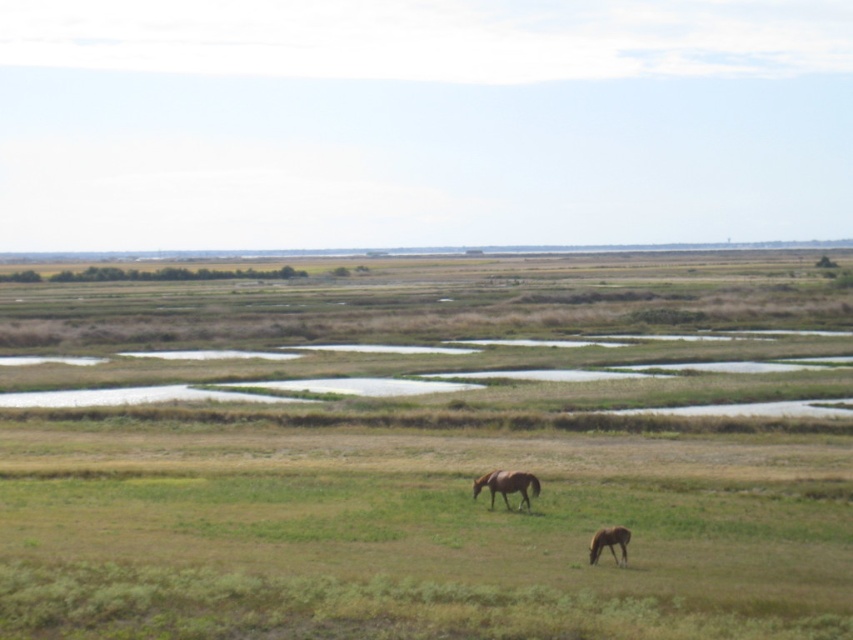
You are a photographer trying to capture both the brown glossy horse at center and the brown glossy horse at lower right in a single shot. Based on their positions, which horse would appear closer to the camera in the photo?

The brown glossy horse at center appears closer to the camera because the brown glossy horse at lower right is positioned behind it.

You are standing at point (605,534) and want to walk to the point (488,480). Which direction should you move in?

You should move forward because point (488,480) is behind point (605,534), meaning it is in the direction you are facing.

You are a farmer checking the field. You see the brown glossy horse at center and the brown glossy horse at lower right. Which horse is wider?

The brown glossy horse at center might be wider than brown glossy horse at lower right.